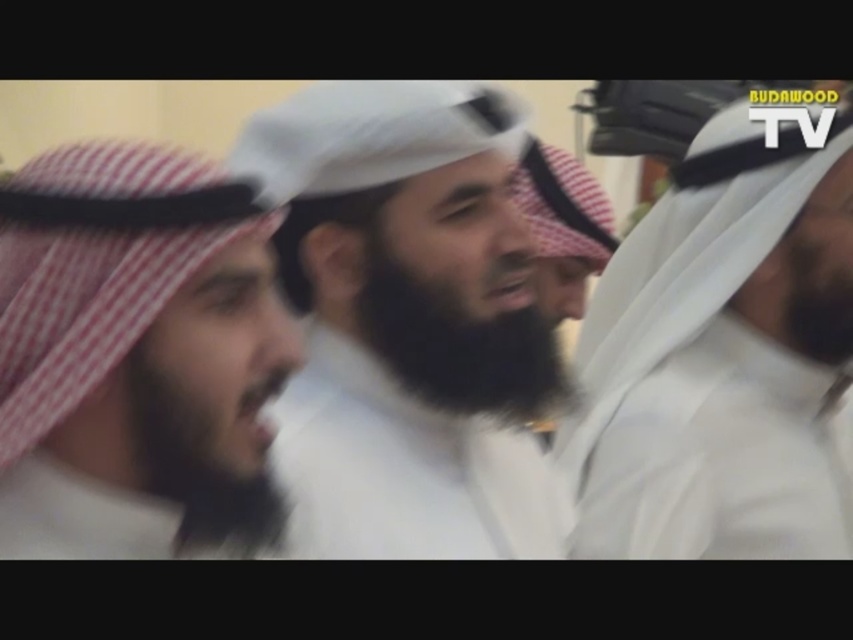
Question: Which point is closer to the camera?

Choices:
 (A) black fuzzy beard at center
 (B) white matte headscarf at center
 (C) white matte headscarf at right
 (D) black fuzzy beard at left

Answer: (D)

Question: Can you confirm if white matte headscarf at right is bigger than black fuzzy beard at left?

Choices:
 (A) no
 (B) yes

Answer: (B)

Question: Can you confirm if white checkered headscarf at left is positioned below black fuzzy beard at center?

Choices:
 (A) no
 (B) yes

Answer: (B)

Question: Considering the real-world distances, which object is closest to the black fuzzy beard at center?

Choices:
 (A) white matte headscarf at right
 (B) white matte headscarf at center

Answer: (B)

Question: Is white matte headscarf at center in front of white matte headscarf at right?

Choices:
 (A) yes
 (B) no

Answer: (A)

Question: Which of the following is the farthest from the observer?

Choices:
 (A) (495, 385)
 (B) (299, 362)

Answer: (A)